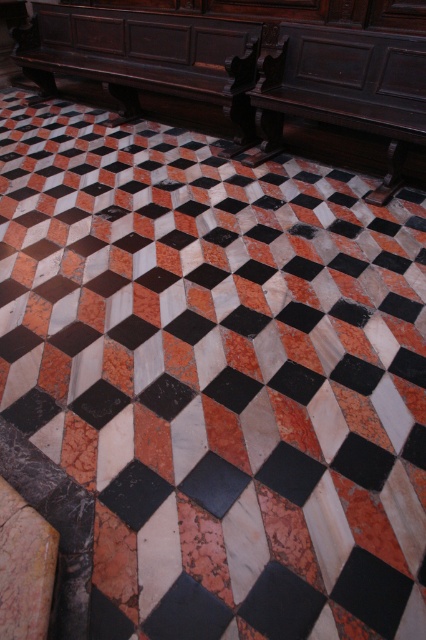
Between polished dark wood bench at center and dark wood bench at center, which one is positioned lower?

polished dark wood bench at center is below.

Between polished dark wood bench at center and dark wood bench at center, which one has more height?

Standing taller between the two is polished dark wood bench at center.

Does point (255, 36) come farther from viewer compared to point (146, 54)?

No, (255, 36) is closer to viewer.

Find the location of `polished dark wood bench at center`. polished dark wood bench at center is located at coordinates (249, 61).

Which is in front, point (74, 26) or point (307, 64)?

Point (307, 64)

Where is `dark wood bench at center`? The image size is (426, 640). dark wood bench at center is located at coordinates (146, 58).

Is point (204, 84) positioned before point (405, 90)?

That is False.

Find the location of a particular element. Image resolution: width=426 pixels, height=640 pixels. dark wood bench at center is located at coordinates (146, 58).

Who is higher up, polished dark wood bench at center or dark polished wood bench at upper right?

polished dark wood bench at center is above.

Which is more to the right, polished dark wood bench at center or dark polished wood bench at upper right?

Positioned to the right is dark polished wood bench at upper right.

Identify the location of polished dark wood bench at center. (249, 61).